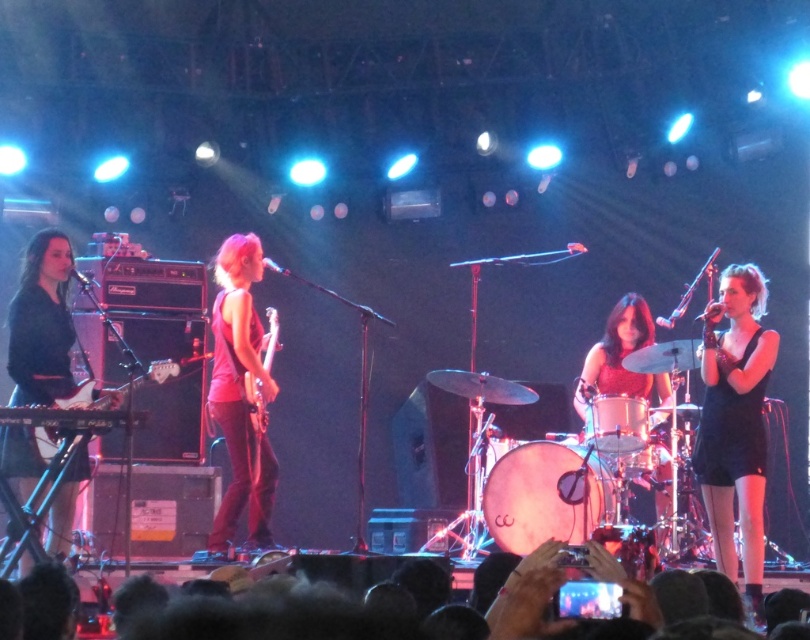
Question: Estimate the real-world distances between objects in this image. Which object is closer to the smooth black drum at center?

Choices:
 (A) matte black drum at center
 (B) glossy wood guitar at center
 (C) pink fabric guitar at center
 (D) matte black keyboardist at left

Answer: (A)

Question: Estimate the real-world distances between objects in this image. Which object is closer to the black matte dress at right?

Choices:
 (A) pink fabric guitar at center
 (B) matte black keyboardist at left
 (C) matte black drum at center

Answer: (C)

Question: Does black matte dress at right have a smaller size compared to glossy wood guitar at center?

Choices:
 (A) yes
 (B) no

Answer: (B)

Question: Is black matte dress at right positioned at the back of pink fabric guitar at center?

Choices:
 (A) no
 (B) yes

Answer: (A)

Question: Which of the following is the closest to the observer?

Choices:
 (A) (259, 428)
 (B) (636, 397)
 (C) (706, 460)
 (D) (45, 317)

Answer: (D)

Question: Where is matte black drum at center located in relation to glossy wood guitar at center in the image?

Choices:
 (A) below
 (B) above

Answer: (A)